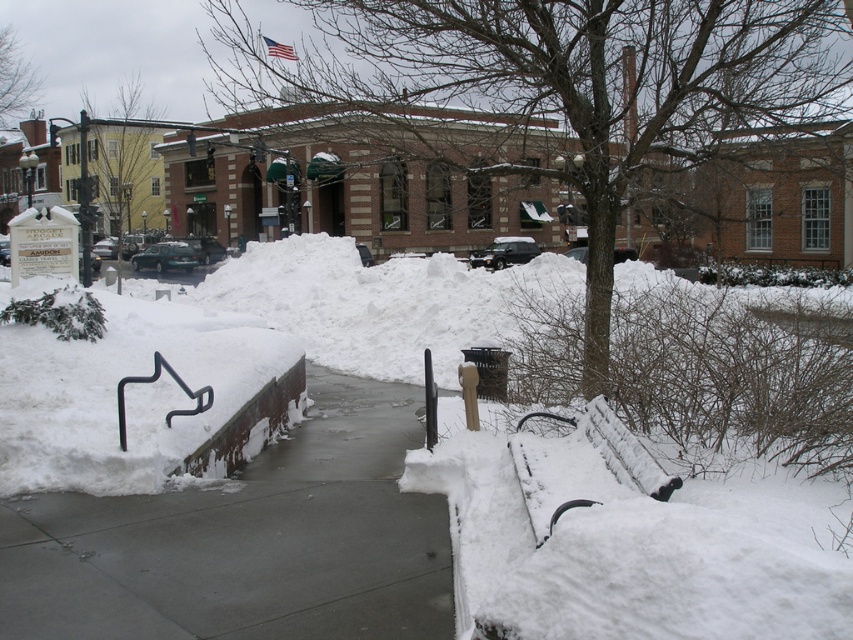
Question: Which object appears farthest from the camera in this image?

Choices:
 (A) smooth concrete path at center
 (B) snow-covered wood bench at lower right

Answer: (A)

Question: Does smooth concrete path at center appear on the left side of snow-covered wood bench at lower right?

Choices:
 (A) no
 (B) yes

Answer: (B)

Question: Is smooth concrete path at center below snow-covered wood bench at lower right?

Choices:
 (A) no
 (B) yes

Answer: (B)

Question: Can you confirm if smooth concrete path at center is wider than snow-covered wood bench at lower right?

Choices:
 (A) no
 (B) yes

Answer: (B)